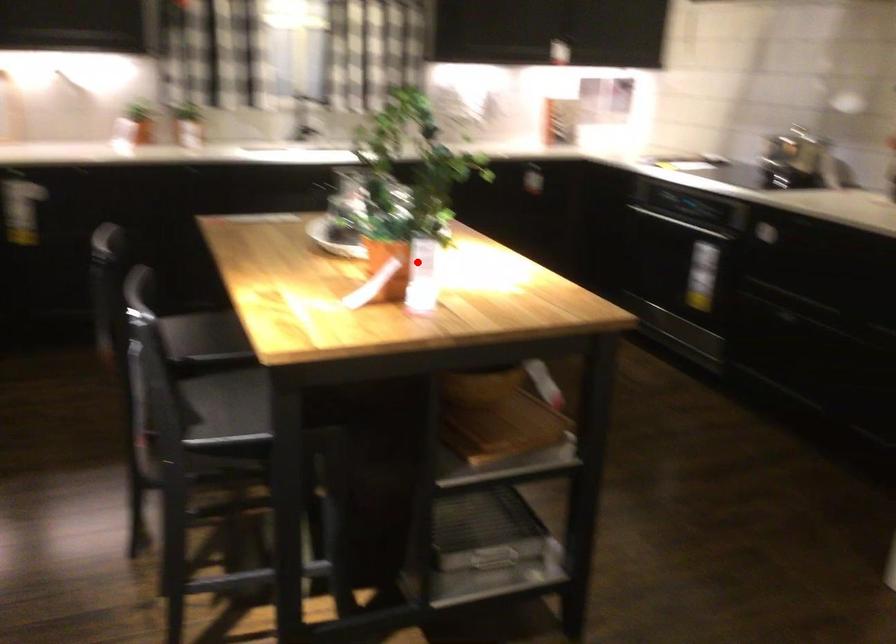
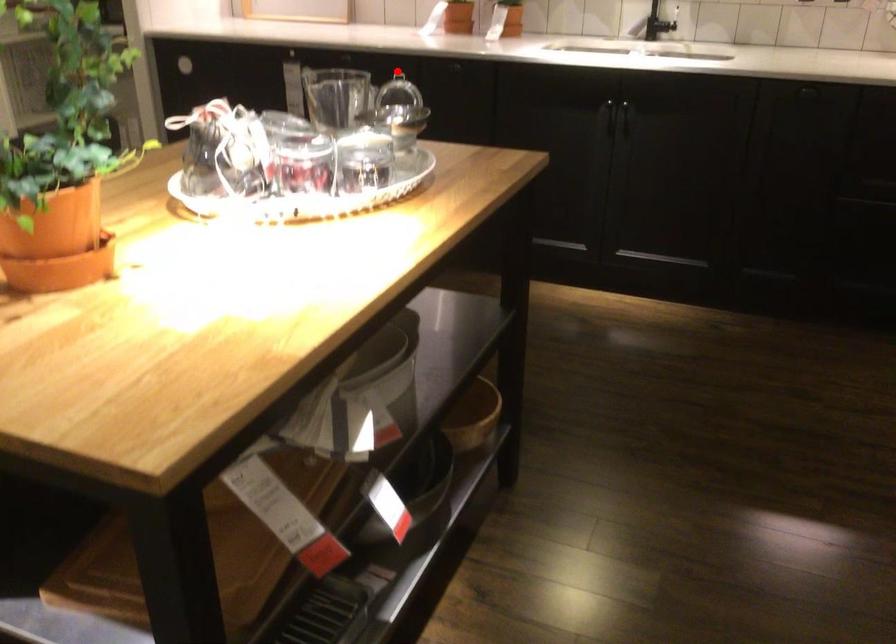
I am providing you with two images of the same scene from different viewpoints. A red point is marked on the first image and another point is marked on the second image. Is the marked point in image1 the same physical position as the marked point in image2?

No